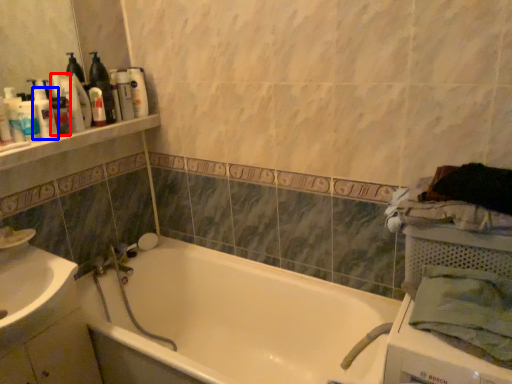
Question: Which object is further to the camera taking this photo, toiletry (highlighted by a red box) or toiletry (highlighted by a blue box)?

Choices:
 (A) toiletry
 (B) toiletry

Answer: (A)